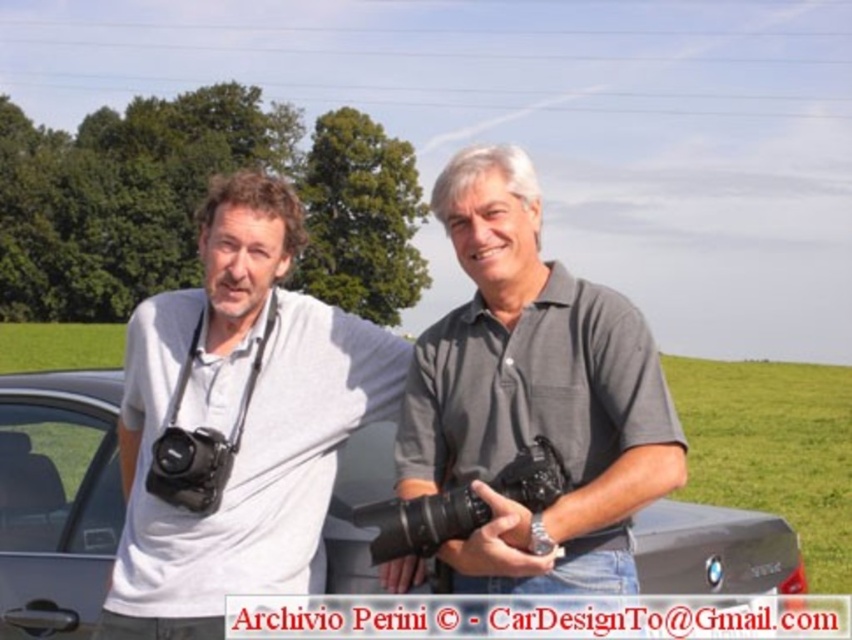
Question: Can you confirm if black plastic camera at center is wider than black matte camera at left?

Choices:
 (A) no
 (B) yes

Answer: (B)

Question: Estimate the real-world distances between objects in this image. Which object is closer to the black matte camera at left?

Choices:
 (A) matte gray shirt at left
 (B) satin silver car at center

Answer: (A)

Question: Does gray cotton polo shirt at center have a smaller size compared to black plastic camera at center?

Choices:
 (A) yes
 (B) no

Answer: (B)

Question: Does satin silver car at center lie in front of black matte camera at left?

Choices:
 (A) yes
 (B) no

Answer: (B)

Question: Among these objects, which one is nearest to the camera?

Choices:
 (A) gray cotton polo shirt at center
 (B) black matte camera at left
 (C) black plastic camera at center

Answer: (A)

Question: Which point is closer to the camera?

Choices:
 (A) (158, 355)
 (B) (487, 330)

Answer: (B)